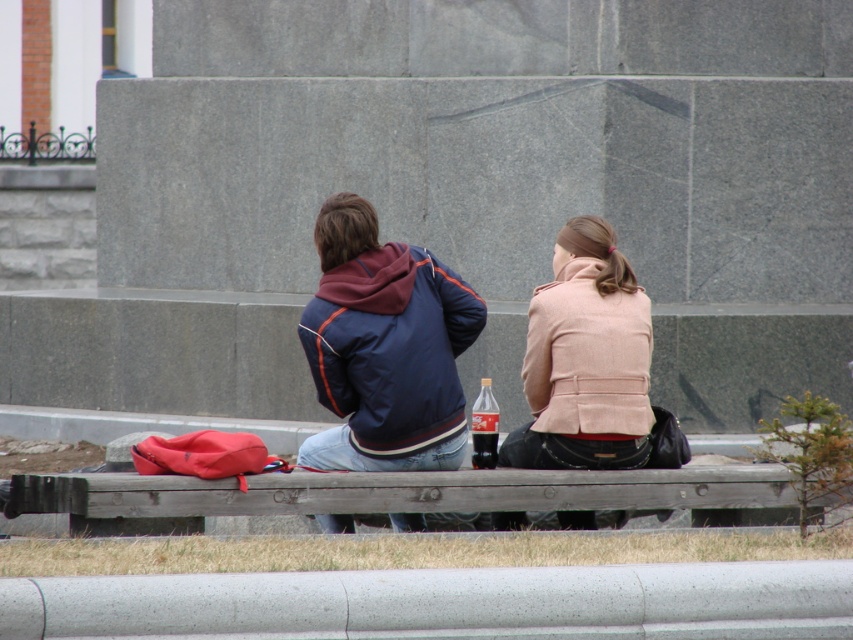
Describe the element at coordinates (396, 492) in the screenshot. This screenshot has width=853, height=640. I see `wooden bench at center` at that location.

Between wooden bench at center and translucent plastic soda can at center, which one has more height?

With more height is translucent plastic soda can at center.

Where is `wooden bench at center`? Image resolution: width=853 pixels, height=640 pixels. wooden bench at center is located at coordinates (396, 492).

The height and width of the screenshot is (640, 853). What do you see at coordinates (396, 492) in the screenshot?
I see `wooden bench at center` at bounding box center [396, 492].

You are a GUI agent. You are given a task and a screenshot of the screen. Output one action in this format:
    pyautogui.click(x=<x>, y=<y>)
    Task: Click on the wooden bench at center
    The height and width of the screenshot is (640, 853).
    Given the screenshot: What is the action you would take?
    pyautogui.click(x=396, y=492)

Between beige woolen coat at center and translucent plastic soda can at center, which one has more height?

beige woolen coat at center is taller.

Is beige woolen coat at center above translucent plastic soda can at center?

Correct, beige woolen coat at center is located above translucent plastic soda can at center.

Locate an element on the screen. This screenshot has width=853, height=640. beige woolen coat at center is located at coordinates (585, 358).

The image size is (853, 640). In order to click on beige woolen coat at center in this screenshot , I will do `click(585, 358)`.